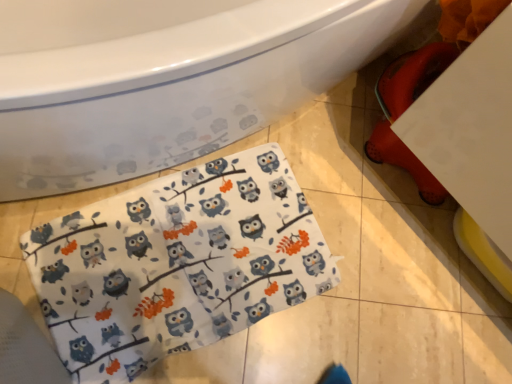
Question: From the image's perspective, is white glossy bathtub at upper left beneath white fabric with owl print at lower center?

Choices:
 (A) no
 (B) yes

Answer: (A)

Question: Can we say white glossy bathtub at upper left lies outside white fabric with owl print at lower center?

Choices:
 (A) yes
 (B) no

Answer: (A)

Question: Considering the relative positions of white glossy bathtub at upper left and white fabric with owl print at lower center in the image provided, is white glossy bathtub at upper left to the right of white fabric with owl print at lower center from the viewer's perspective?

Choices:
 (A) no
 (B) yes

Answer: (A)

Question: Considering the relative sizes of white glossy bathtub at upper left and white fabric with owl print at lower center in the image provided, is white glossy bathtub at upper left smaller than white fabric with owl print at lower center?

Choices:
 (A) no
 (B) yes

Answer: (A)

Question: Does white glossy bathtub at upper left lie behind white fabric with owl print at lower center?

Choices:
 (A) yes
 (B) no

Answer: (B)

Question: From a real-world perspective, is white glossy bathtub at upper left positioned under white fabric with owl print at lower center based on gravity?

Choices:
 (A) no
 (B) yes

Answer: (A)

Question: Considering the relative positions of white fabric with owl print at lower center and white glossy bathtub at upper left in the image provided, is white fabric with owl print at lower center to the right of white glossy bathtub at upper left from the viewer's perspective?

Choices:
 (A) no
 (B) yes

Answer: (B)

Question: From the image's perspective, is white fabric with owl print at lower center under white glossy bathtub at upper left?

Choices:
 (A) no
 (B) yes

Answer: (B)

Question: Is white fabric with owl print at lower center beside white glossy bathtub at upper left?

Choices:
 (A) no
 (B) yes

Answer: (A)

Question: From the image's perspective, would you say white fabric with owl print at lower center is positioned over white glossy bathtub at upper left?

Choices:
 (A) no
 (B) yes

Answer: (A)

Question: Considering the relative sizes of white fabric with owl print at lower center and white glossy bathtub at upper left in the image provided, is white fabric with owl print at lower center smaller than white glossy bathtub at upper left?

Choices:
 (A) yes
 (B) no

Answer: (A)

Question: Is white fabric with owl print at lower center turned away from white glossy bathtub at upper left?

Choices:
 (A) yes
 (B) no

Answer: (A)

Question: From a real-world perspective, is white glossy bathtub at upper left physically located above or below white fabric with owl print at lower center?

Choices:
 (A) above
 (B) below

Answer: (A)